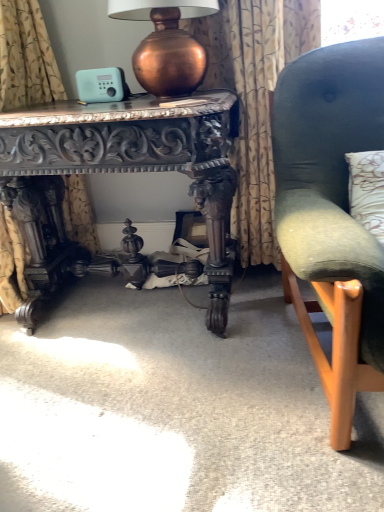
Question: Considering the relative positions of velvet green chair at right and gold floral fabric at left, the second curtain when ordered from right to left, in the image provided, is velvet green chair at right behind gold floral fabric at left, the second curtain when ordered from right to left,?

Choices:
 (A) yes
 (B) no

Answer: (B)

Question: Does velvet green chair at right appear on the right side of gold floral fabric at left, the second curtain when ordered from right to left?

Choices:
 (A) no
 (B) yes

Answer: (B)

Question: From the image's perspective, is velvet green chair at right over gold floral fabric at left, which is the 1th curtain in left-to-right order?

Choices:
 (A) yes
 (B) no

Answer: (B)

Question: Considering the relative sizes of velvet green chair at right and gold floral fabric at left, the second curtain when ordered from right to left, in the image provided, is velvet green chair at right bigger than gold floral fabric at left, the second curtain when ordered from right to left,?

Choices:
 (A) yes
 (B) no

Answer: (A)

Question: Can you confirm if velvet green chair at right is thinner than gold floral fabric at left, which is the 1th curtain in left-to-right order?

Choices:
 (A) yes
 (B) no

Answer: (B)

Question: Considering the positions of copper metallic table lamp at upper center and velvet green chair at right in the image, is copper metallic table lamp at upper center wider or thinner than velvet green chair at right?

Choices:
 (A) thin
 (B) wide

Answer: (A)

Question: Considering the positions of copper metallic table lamp at upper center and velvet green chair at right in the image, is copper metallic table lamp at upper center taller or shorter than velvet green chair at right?

Choices:
 (A) tall
 (B) short

Answer: (B)

Question: Looking at the image, does copper metallic table lamp at upper center seem bigger or smaller compared to velvet green chair at right?

Choices:
 (A) big
 (B) small

Answer: (B)

Question: Relative to velvet green chair at right, is copper metallic table lamp at upper center in front or behind?

Choices:
 (A) front
 (B) behind

Answer: (B)

Question: Is point (321, 209) closer or farther from the camera than point (168, 141)?

Choices:
 (A) closer
 (B) farther

Answer: (A)

Question: Considering the relative positions of velvet green chair at right and dark wood carved table at center in the image provided, is velvet green chair at right to the left or to the right of dark wood carved table at center?

Choices:
 (A) left
 (B) right

Answer: (B)

Question: From their relative heights in the image, would you say velvet green chair at right is taller or shorter than dark wood carved table at center?

Choices:
 (A) short
 (B) tall

Answer: (B)

Question: Is velvet green chair at right situated inside dark wood carved table at center or outside?

Choices:
 (A) outside
 (B) inside

Answer: (A)

Question: Is floral-patterned fabric at center, positioned as the 1th curtain in right-to-left order, wider or thinner than velvet green chair at right?

Choices:
 (A) wide
 (B) thin

Answer: (B)

Question: Looking at the image, does floral-patterned fabric at center, the 2th curtain positioned from the left, seem bigger or smaller compared to velvet green chair at right?

Choices:
 (A) small
 (B) big

Answer: (A)